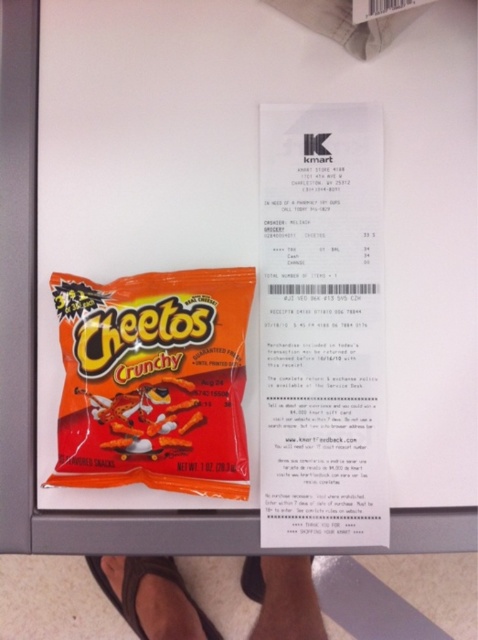
Is orange matte cheetos crunchy at center wider than black rubber sandal at lower center?

No, orange matte cheetos crunchy at center is not wider than black rubber sandal at lower center.

Is orange matte cheetos crunchy at center to the left of black rubber sandal at lower center from the viewer's perspective?

Incorrect, orange matte cheetos crunchy at center is not on the left side of black rubber sandal at lower center.

Which is in front, point (181, 394) or point (152, 556)?

Point (181, 394) is more forward.

Identify the location of orange matte cheetos crunchy at center. (149, 417).

Is point (384, 536) positioned before point (128, 433)?

No, it is behind (128, 433).

Who is shorter, white paper receipt at center or orange matte cheetos crunchy at center?

orange matte cheetos crunchy at center is shorter.

Between point (292, 538) and point (196, 413), which one is positioned in front?

Point (196, 413) is more forward.

This screenshot has height=640, width=478. I want to click on white paper receipt at center, so click(322, 326).

Is orange matte cheetos crunchy at left thinner than orange matte cheetos crunchy at center?

No, orange matte cheetos crunchy at left is not thinner than orange matte cheetos crunchy at center.

Is orange matte cheetos crunchy at left closer to the viewer compared to orange matte cheetos crunchy at center?

Yes.

At what (x,y) coordinates should I click in order to perform the action: click on orange matte cheetos crunchy at left. Please return your answer as a coordinate pair (x, y). The image size is (478, 640). Looking at the image, I should click on (153, 381).